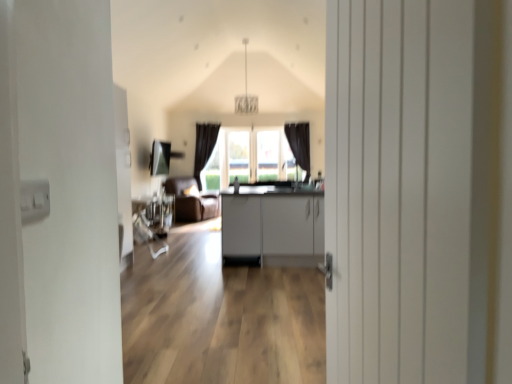
Question: From the image's perspective, is matte gray cabinets at center beneath brown leather armchair at center?

Choices:
 (A) yes
 (B) no

Answer: (A)

Question: Is matte gray cabinets at center directly adjacent to brown leather armchair at center?

Choices:
 (A) no
 (B) yes

Answer: (A)

Question: Can you confirm if matte gray cabinets at center is bigger than brown leather armchair at center?

Choices:
 (A) yes
 (B) no

Answer: (A)

Question: From the image's perspective, would you say matte gray cabinets at center is positioned over brown leather armchair at center?

Choices:
 (A) yes
 (B) no

Answer: (B)

Question: Is matte gray cabinets at center further to the viewer compared to brown leather armchair at center?

Choices:
 (A) yes
 (B) no

Answer: (B)

Question: Is matte gray cabinets at center thinner than brown leather armchair at center?

Choices:
 (A) yes
 (B) no

Answer: (B)

Question: Are brown leather armchair at center and white wooden door at center beside each other?

Choices:
 (A) no
 (B) yes

Answer: (A)

Question: Considering the relative positions of brown leather armchair at center and white wooden door at center in the image provided, is brown leather armchair at center to the left of white wooden door at center from the viewer's perspective?

Choices:
 (A) yes
 (B) no

Answer: (A)

Question: Is brown leather armchair at center at the right side of white wooden door at center?

Choices:
 (A) yes
 (B) no

Answer: (B)

Question: From a real-world perspective, is brown leather armchair at center located beneath white wooden door at center?

Choices:
 (A) yes
 (B) no

Answer: (A)

Question: Would you say white wooden door at center is part of brown leather armchair at center's contents?

Choices:
 (A) yes
 (B) no

Answer: (B)

Question: Considering the relative sizes of brown leather armchair at center and white wooden door at center in the image provided, is brown leather armchair at center thinner than white wooden door at center?

Choices:
 (A) no
 (B) yes

Answer: (A)

Question: Can you confirm if matte gray cabinets at center is positioned to the left of white wooden door at center?

Choices:
 (A) yes
 (B) no

Answer: (B)